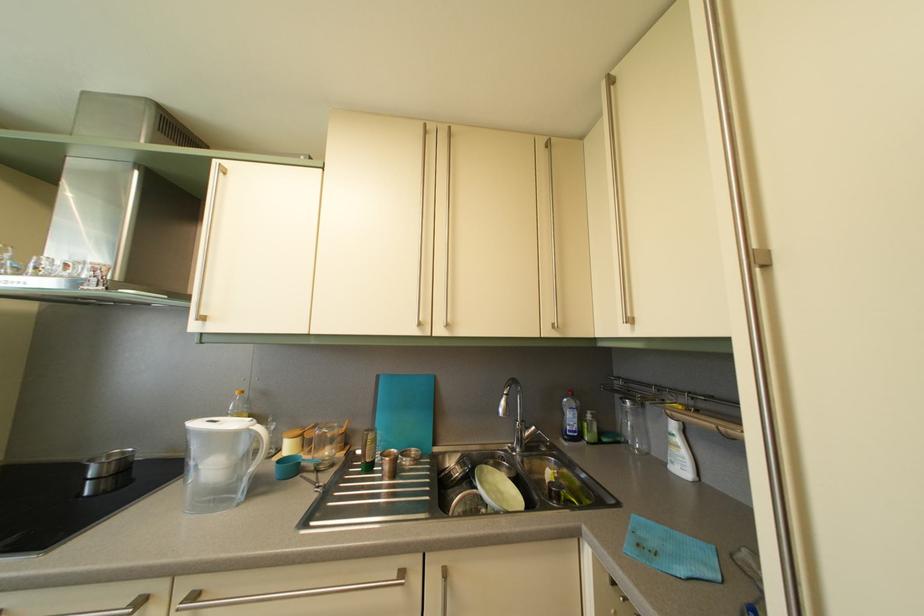
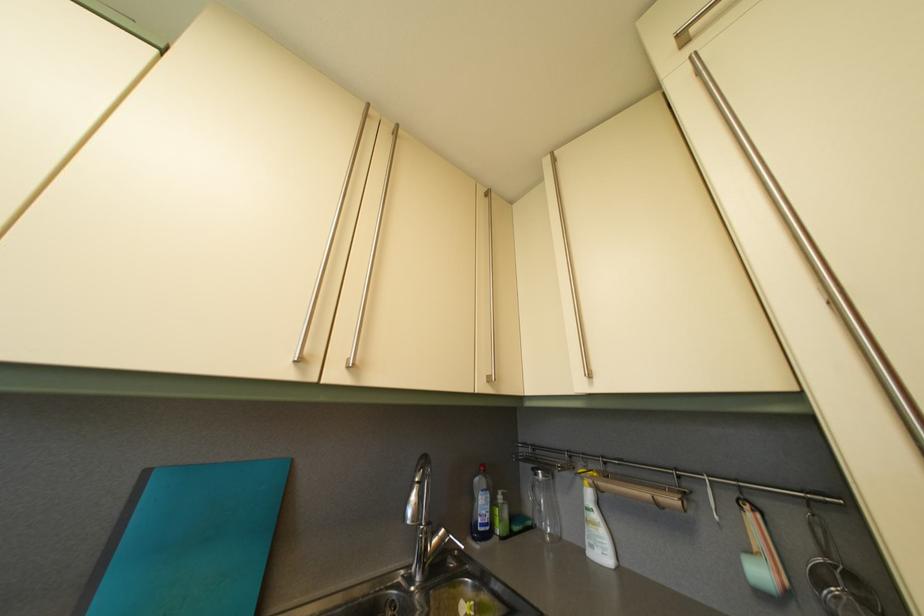
In the second image, find the point that corresponds to [556,325] in the first image.

(492, 376)